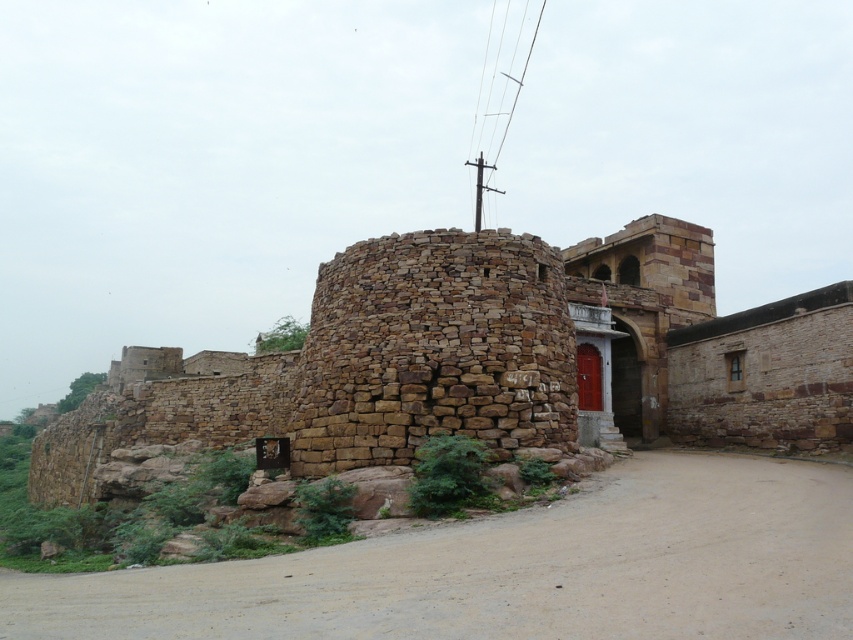
Question: Which point is closer to the camera?

Choices:
 (A) brown stone fort at center
 (B) brown sandy dirt track at center

Answer: (B)

Question: Which point is closer to the camera?

Choices:
 (A) click(x=303, y=604)
 (B) click(x=679, y=422)

Answer: (A)

Question: Which of the following is the farthest from the observer?

Choices:
 (A) brown stone fort at center
 (B) brown sandy dirt track at center

Answer: (A)

Question: Does brown stone fort at center come behind brown sandy dirt track at center?

Choices:
 (A) yes
 (B) no

Answer: (A)

Question: Can you confirm if brown stone fort at center is positioned above brown sandy dirt track at center?

Choices:
 (A) no
 (B) yes

Answer: (A)

Question: Does brown stone fort at center appear on the left side of brown sandy dirt track at center?

Choices:
 (A) yes
 (B) no

Answer: (A)